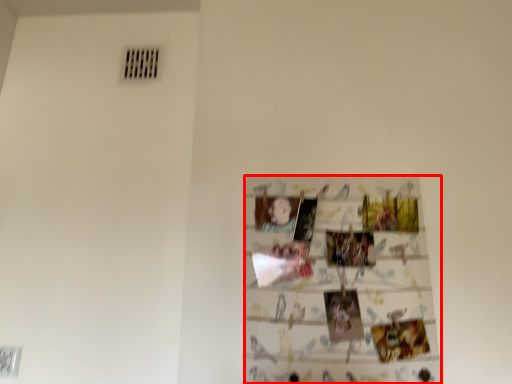
Question: Considering the relative positions of print (annotated by the red box) and person in the image provided, where is print (annotated by the red box) located with respect to the staircase?

Choices:
 (A) right
 (B) left

Answer: (A)